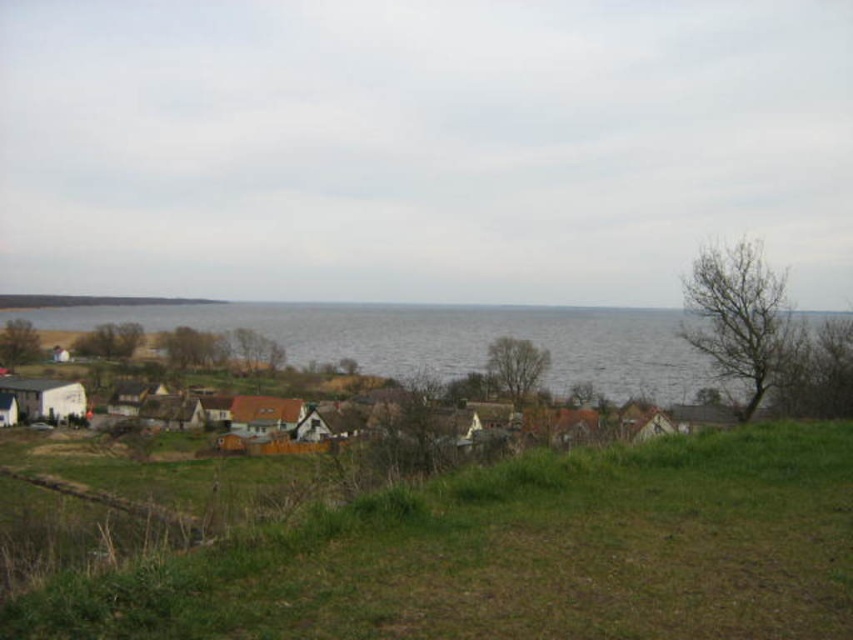
You are a landscape architect planning to install a new garden in the green grassy field at lower center. Considering the height difference between it and the white wooden houses at lower left, what potential issue might arise with this plan?

The green grassy field at lower center has a lesser height compared to the white wooden houses at lower left. This could lead to water pooling on the field during heavy rains, as it is lower than the houses, potentially causing drainage issues.

You are standing at the wooden fence in the lower left corner of the coastal village scene. You want to walk directly towards the green grassy field at lower center. In which general direction should you head?

The green grassy field at lower center is located at point (518, 554), so you should head towards the upper right direction from the wooden fence in the lower left corner to reach it.